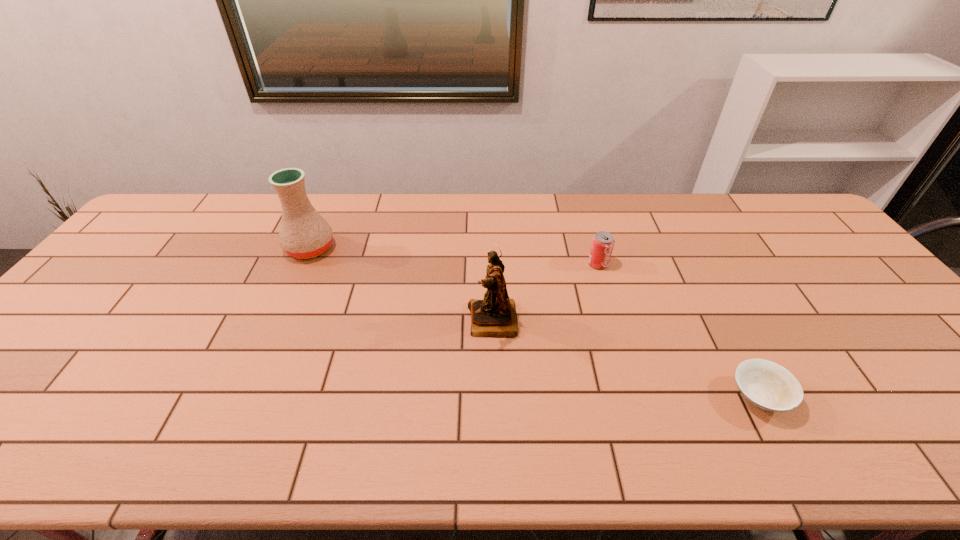
Locate an element on the screen. vacant space that is in between the second object from left to right and the shortest object is located at coordinates (626, 359).

Find the location of `object that is the second closest one to the shortest object`. object that is the second closest one to the shortest object is located at coordinates (495, 316).

This screenshot has width=960, height=540. What are the coordinates of `object that can be found as the third closest to the second object from right to left` in the screenshot? It's located at (304, 233).

Where is `vacant space that satisfies the following two spatial constraints: 1. on the back side of the nearest object; 2. on the front-facing side of the third farthest object`? The height and width of the screenshot is (540, 960). vacant space that satisfies the following two spatial constraints: 1. on the back side of the nearest object; 2. on the front-facing side of the third farthest object is located at coordinates (719, 321).

At what (x,y) coordinates should I click in order to perform the action: click on vacant area that satisfies the following two spatial constraints: 1. on the front-facing side of the bowl; 2. on the left side of the second object from left to right. Please return your answer as a coordinate pair (x, y). Looking at the image, I should click on (494, 396).

Identify the location of free space that satisfies the following two spatial constraints: 1. on the front-facing side of the bowl; 2. on the right side of the third farthest object. (494, 396).

Locate an element on the screen. Image resolution: width=960 pixels, height=540 pixels. vacant space that satisfies the following two spatial constraints: 1. on the front-facing side of the third farthest object; 2. on the back side of the bowl is located at coordinates (494, 396).

At what (x,y) coordinates should I click in order to perform the action: click on free spot that satisfies the following two spatial constraints: 1. on the front-facing side of the nearest object; 2. on the left side of the figurine. Please return your answer as a coordinate pair (x, y). The width and height of the screenshot is (960, 540). Looking at the image, I should click on (494, 396).